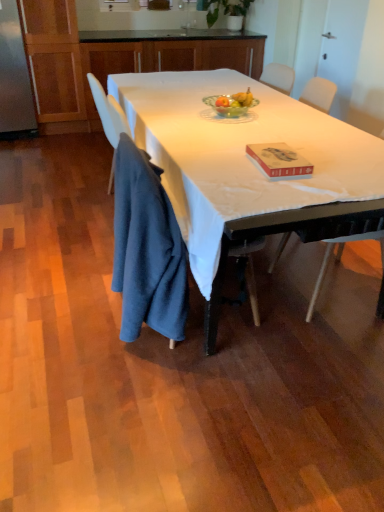
Identify the location of vacant space situated on the left part of red matte book at center. (228, 168).